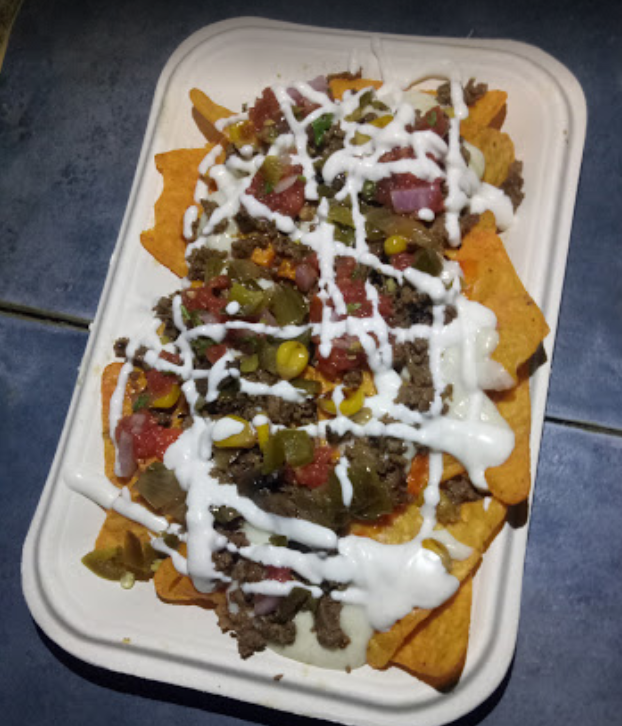
The width and height of the screenshot is (622, 726). What are the coordinates of `corner` in the screenshot? It's located at (604, 716), (19, 706), (14, 32), (604, 12).